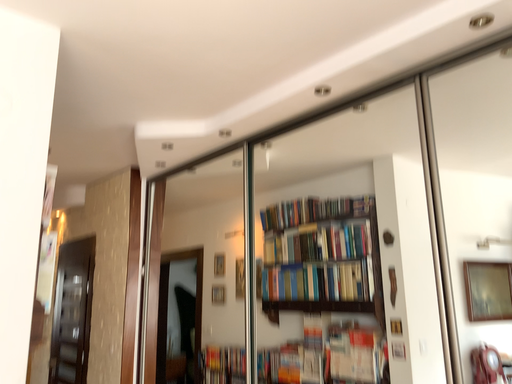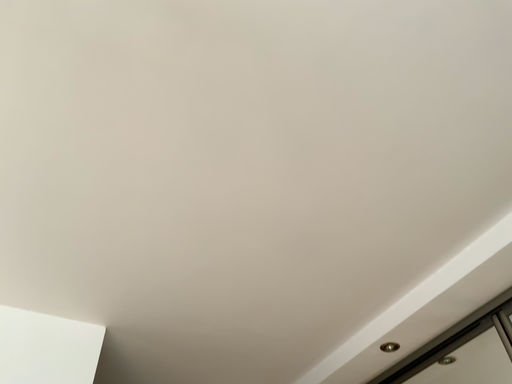
Question: How did the camera likely rotate when shooting the video?

Choices:
 (A) rotated upward
 (B) rotated downward

Answer: (A)